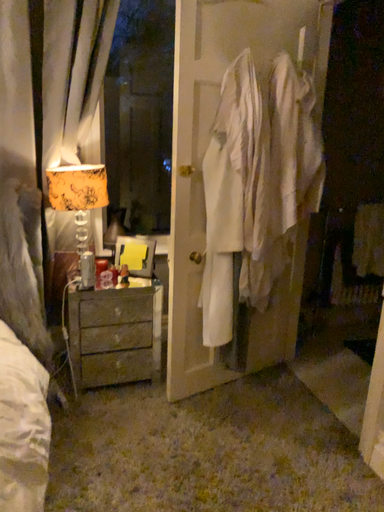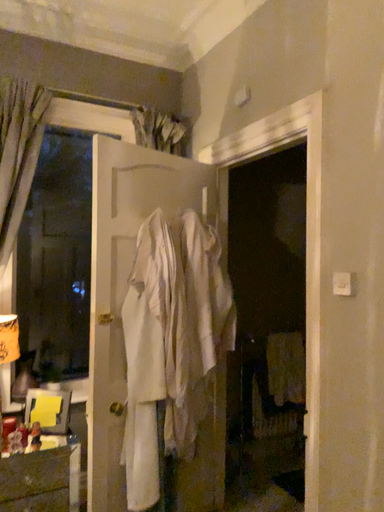
Question: How did the camera likely rotate when shooting the video?

Choices:
 (A) rotated upward
 (B) rotated downward

Answer: (A)